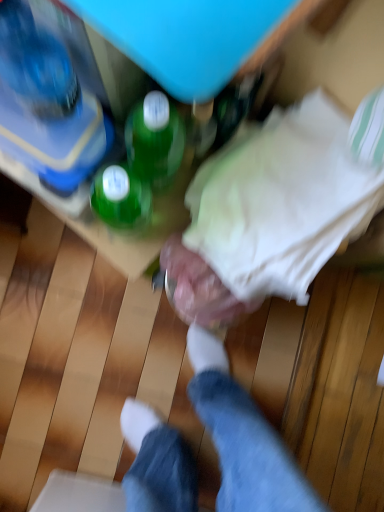
Question: Is metallic silver dumbbell at center completely or partially outside of translucent plastic bottle at upper left?

Choices:
 (A) yes
 (B) no

Answer: (A)

Question: Can you confirm if metallic silver dumbbell at center is shorter than translucent plastic bottle at upper left?

Choices:
 (A) yes
 (B) no

Answer: (B)

Question: Is metallic silver dumbbell at center positioned before translucent plastic bottle at upper left?

Choices:
 (A) yes
 (B) no

Answer: (B)

Question: Can you see metallic silver dumbbell at center touching translucent plastic bottle at upper left?

Choices:
 (A) yes
 (B) no

Answer: (B)

Question: From a real-world perspective, is metallic silver dumbbell at center beneath translucent plastic bottle at upper left?

Choices:
 (A) yes
 (B) no

Answer: (A)

Question: Could you tell me if metallic silver dumbbell at center is facing translucent plastic bottle at upper left?

Choices:
 (A) no
 (B) yes

Answer: (A)

Question: From a real-world perspective, is white fabric at center beneath green glass bottle at upper center?

Choices:
 (A) yes
 (B) no

Answer: (A)

Question: Is white fabric at center beside green glass bottle at upper center?

Choices:
 (A) yes
 (B) no

Answer: (B)

Question: Can you confirm if white fabric at center is thinner than green glass bottle at upper center?

Choices:
 (A) yes
 (B) no

Answer: (B)

Question: Is white fabric at center positioned before green glass bottle at upper center?

Choices:
 (A) yes
 (B) no

Answer: (B)

Question: Is white fabric at center aimed at green glass bottle at upper center?

Choices:
 (A) yes
 (B) no

Answer: (B)

Question: Considering the relative sizes of white fabric at center and green glass bottle at upper center in the image provided, is white fabric at center wider than green glass bottle at upper center?

Choices:
 (A) yes
 (B) no

Answer: (A)

Question: From the image's perspective, does metallic silver dumbbell at center appear higher than white fabric at center?

Choices:
 (A) yes
 (B) no

Answer: (B)